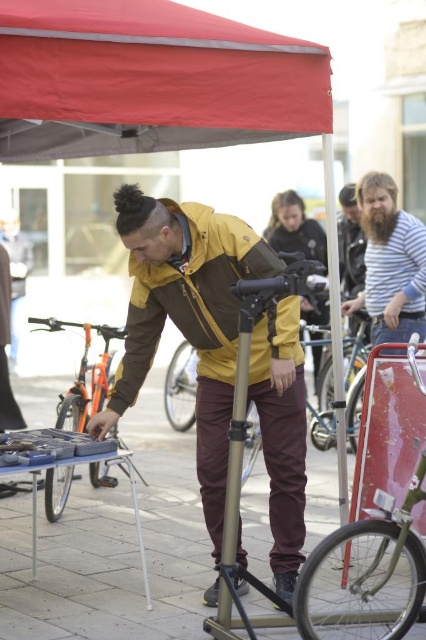
Question: Considering the relative positions of maroon fabric pants at center and orange matte bicycle at left in the image provided, where is maroon fabric pants at center located with respect to orange matte bicycle at left?

Choices:
 (A) above
 (B) below

Answer: (B)

Question: Is red fabric canopy at upper center positioned before striped fabric shirt at upper right?

Choices:
 (A) yes
 (B) no

Answer: (A)

Question: Is red fabric canopy at upper center positioned in front of matte yellow jacket at center?

Choices:
 (A) yes
 (B) no

Answer: (A)

Question: Which point appears closest to the camera in this image?

Choices:
 (A) (57, 150)
 (B) (198, 260)
 (C) (78, 616)
 (D) (104, 372)

Answer: (C)

Question: Which of the following is the closest to the observer?

Choices:
 (A) (144, 92)
 (B) (184, 321)
 (C) (65, 412)
 (D) (89, 577)

Answer: (A)

Question: Which object is closer to the camera taking this photo?

Choices:
 (A) red fabric canopy at upper center
 (B) orange matte bicycle at left
 (C) brown matte jacket at center
 (D) maroon fabric pants at center

Answer: (A)